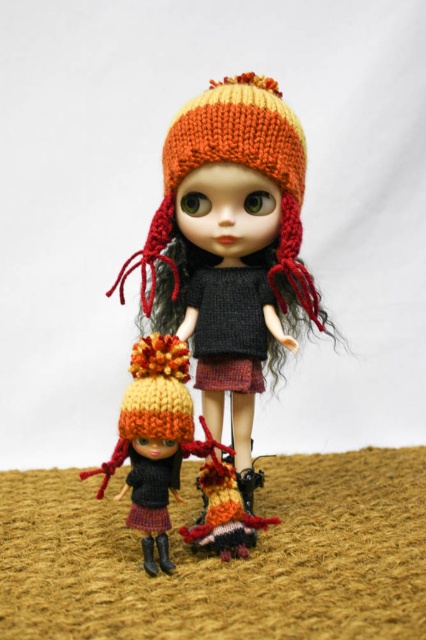
Question: Which object is positioned closest to the knitted woolen hat at center?

Choices:
 (A) knitted woolen dress at lower center
 (B) matte orange knit hat at lower left

Answer: (B)

Question: Can you confirm if knitted woolen hat at center is positioned to the right of knitted dark gray dress at center?

Choices:
 (A) no
 (B) yes

Answer: (A)

Question: Can you confirm if knitted woolen hat at center is smaller than knitted woolen dress at lower center?

Choices:
 (A) no
 (B) yes

Answer: (A)

Question: Does matte orange knit hat at lower left have a smaller size compared to knitted dark gray dress at center?

Choices:
 (A) yes
 (B) no

Answer: (B)

Question: Which point is closer to the camera taking this photo?

Choices:
 (A) (265, 188)
 (B) (224, 285)
 (C) (143, 381)

Answer: (C)

Question: Estimate the real-world distances between objects in this image. Which object is closer to the matte orange knit hat at lower left?

Choices:
 (A) knitted dark gray dress at center
 (B) knitted woolen dress at lower center

Answer: (B)